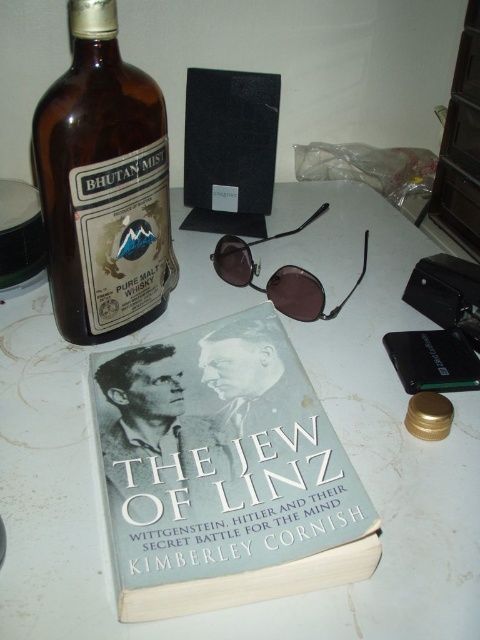
Question: Can you confirm if white matte table at center is positioned above hardcover book at center?

Choices:
 (A) yes
 (B) no

Answer: (A)

Question: Which point is closer to the camera?

Choices:
 (A) brown glass bottle at upper left
 (B) metallic brown sunglasses at center

Answer: (A)

Question: Which is nearer to the metallic brown sunglasses at center?

Choices:
 (A) white matte table at center
 (B) hardcover book at center

Answer: (A)

Question: Is hardcover book at center positioned before brown glass bottle at upper left?

Choices:
 (A) yes
 (B) no

Answer: (A)

Question: Is hardcover book at center positioned before brown glass bottle at upper left?

Choices:
 (A) no
 (B) yes

Answer: (B)

Question: Among these points, which one is nearest to the camera?

Choices:
 (A) (238, 451)
 (B) (87, 214)
 (C) (320, 292)

Answer: (A)